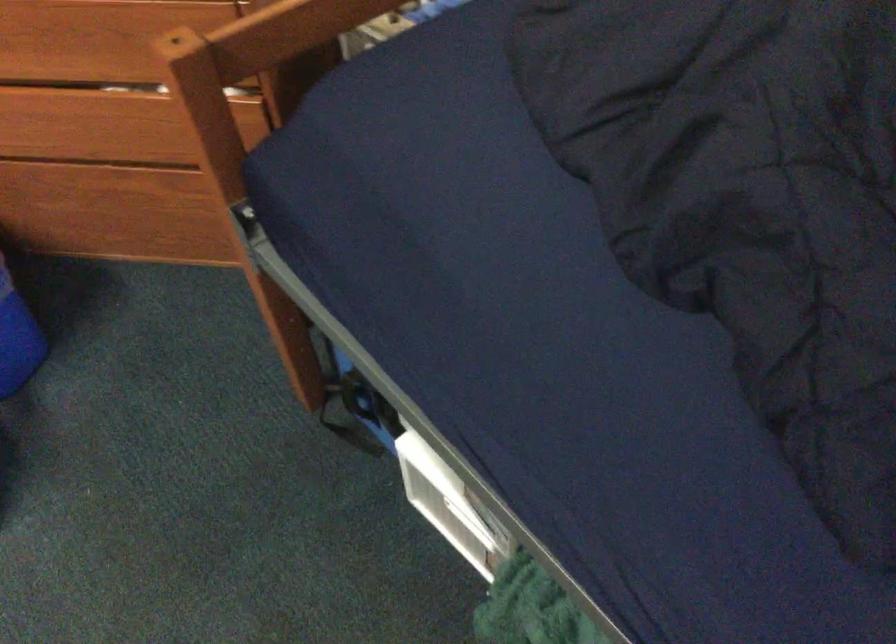
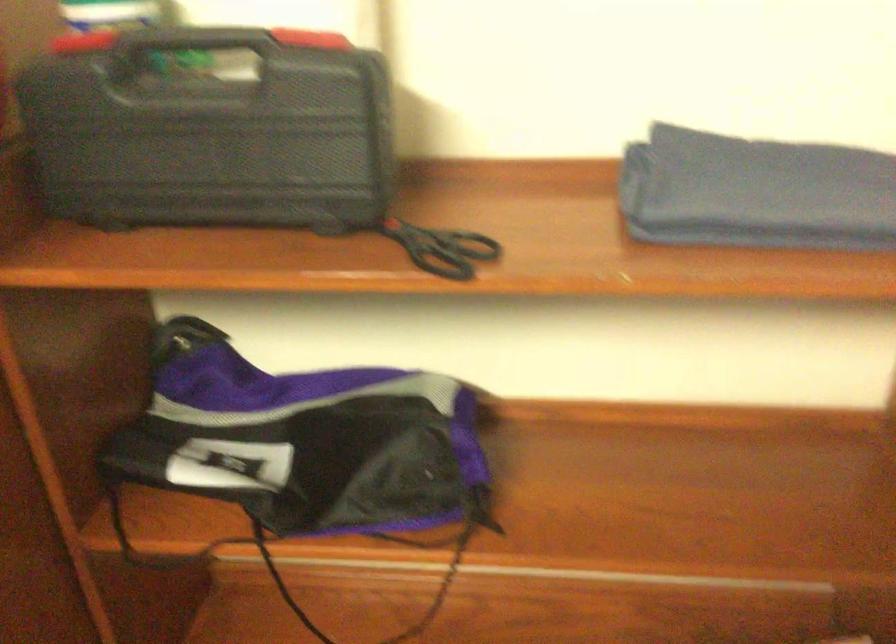
In a continuous first-person perspective shot, in which direction is the camera moving?

The movement direction of the cameraman is left, forward.